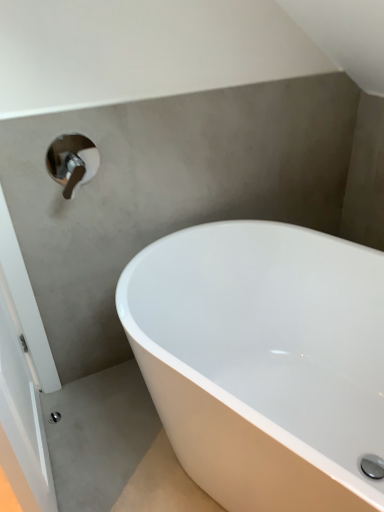
Locate an element on the screen. The height and width of the screenshot is (512, 384). satin nickel faucet at upper left is located at coordinates (72, 161).

Describe the element at coordinates (72, 161) in the screenshot. The height and width of the screenshot is (512, 384). I see `satin nickel faucet at upper left` at that location.

In order to click on white glossy bathtub at lower right in this screenshot , I will do `click(263, 361)`.

Describe the element at coordinates (263, 361) in the screenshot. The height and width of the screenshot is (512, 384). I see `white glossy bathtub at lower right` at that location.

Locate an element on the screen. The width and height of the screenshot is (384, 512). satin nickel faucet at upper left is located at coordinates (72, 161).

Is satin nickel faucet at upper left at the right side of white glossy bathtub at lower right?

No.

Is satin nickel faucet at upper left positioned behind white glossy bathtub at lower right?

Yes.

Considering the points (83, 142) and (145, 261), which point is in front, point (83, 142) or point (145, 261)?

The point (83, 142) is in front.

From the image's perspective, is satin nickel faucet at upper left located above white glossy bathtub at lower right?

Yes, from the image's perspective, satin nickel faucet at upper left is on top of white glossy bathtub at lower right.

From a real-world perspective, relative to white glossy bathtub at lower right, is satin nickel faucet at upper left vertically above or below?

From a real-world perspective, satin nickel faucet at upper left is physically above white glossy bathtub at lower right.

Which of these two, satin nickel faucet at upper left or white glossy bathtub at lower right, is wider?

Wider between the two is white glossy bathtub at lower right.

Who is taller, satin nickel faucet at upper left or white glossy bathtub at lower right?

With more height is white glossy bathtub at lower right.

Does satin nickel faucet at upper left have a larger size compared to white glossy bathtub at lower right?

Incorrect, satin nickel faucet at upper left is not larger than white glossy bathtub at lower right.

Is satin nickel faucet at upper left surrounding white glossy bathtub at lower right?

No, satin nickel faucet at upper left does not contain white glossy bathtub at lower right.

Is satin nickel faucet at upper left next to white glossy bathtub at lower right and touching it?

satin nickel faucet at upper left and white glossy bathtub at lower right are not in contact.

Is satin nickel faucet at upper left positioned with its back to white glossy bathtub at lower right?

No, satin nickel faucet at upper left is not facing away from white glossy bathtub at lower right.

In the image, there is a white glossy bathtub at lower right. Where is `tap above it (from the image's perspective)`? This screenshot has width=384, height=512. tap above it (from the image's perspective) is located at coordinates (72, 161).

Would you say white glossy bathtub at lower right is to the left or to the right of satin nickel faucet at upper left in the picture?

Clearly, white glossy bathtub at lower right is on the right of satin nickel faucet at upper left in the image.

Consider the image. Which object is closer to the camera, white glossy bathtub at lower right or satin nickel faucet at upper left?

white glossy bathtub at lower right is more forward.

Is point (276, 386) positioned after point (78, 170)?

Yes, it is.

From the image's perspective, between white glossy bathtub at lower right and satin nickel faucet at upper left, who is located below?

white glossy bathtub at lower right is shown below in the image.

From a real-world perspective, between white glossy bathtub at lower right and satin nickel faucet at upper left, who is vertically higher?

satin nickel faucet at upper left is physically above.

Between white glossy bathtub at lower right and satin nickel faucet at upper left, which one has smaller width?

satin nickel faucet at upper left is thinner.

Is white glossy bathtub at lower right taller than satin nickel faucet at upper left?

Yes, white glossy bathtub at lower right is taller than satin nickel faucet at upper left.

Is white glossy bathtub at lower right bigger or smaller than satin nickel faucet at upper left?

Clearly, white glossy bathtub at lower right is larger in size than satin nickel faucet at upper left.

Is satin nickel faucet at upper left inside white glossy bathtub at lower right?

Actually, satin nickel faucet at upper left is outside white glossy bathtub at lower right.

Would you say white glossy bathtub at lower right is a long distance from satin nickel faucet at upper left?

white glossy bathtub at lower right is near satin nickel faucet at upper left, not far away.

Is white glossy bathtub at lower right aimed at satin nickel faucet at upper left?

No.

Find the location of a particular element. bathtub below the satin nickel faucet at upper left (from the image's perspective) is located at coordinates (263, 361).

Where is `bathtub that appears below the satin nickel faucet at upper left (from the image's perspective)`? The image size is (384, 512). bathtub that appears below the satin nickel faucet at upper left (from the image's perspective) is located at coordinates (263, 361).

Identify the location of tap located behind the white glossy bathtub at lower right. The width and height of the screenshot is (384, 512). (72, 161).